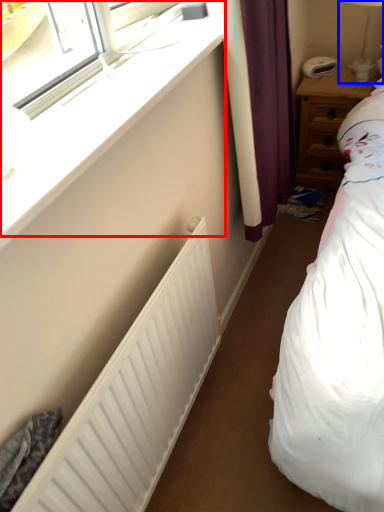
Question: Which point is closer to the camera, window (highlighted by a red box) or bedside lamp (highlighted by a blue box)?

Choices:
 (A) window
 (B) bedside lamp

Answer: (A)